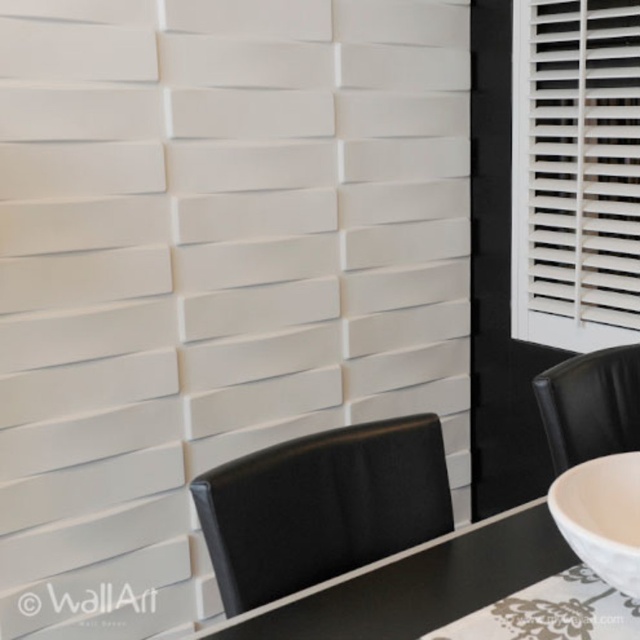
In the scene shown: Who is more forward, (275, 76) or (605, 378)?

Positioned in front is point (605, 378).

Is white matte shutter at right bigger than black leather chair at right?

Yes, white matte shutter at right is bigger than black leather chair at right.

Is point (198, 307) more distant than point (534, 394)?

No.

Where is `white matte shutter at right`? white matte shutter at right is located at coordinates (211, 273).

The height and width of the screenshot is (640, 640). Identify the location of white plastic blinds at upper right. (576, 172).

From the picture: Can you confirm if white plastic blinds at upper right is bigger than black leather chair at right?

Correct, white plastic blinds at upper right is larger in size than black leather chair at right.

Identify the location of white plastic blinds at upper right. Image resolution: width=640 pixels, height=640 pixels. (576, 172).

This screenshot has width=640, height=640. In order to click on white plastic blinds at upper right in this screenshot , I will do `click(576, 172)`.

Is white matte shutter at right closer to camera compared to black leather chair at center?

No, it is behind black leather chair at center.

From the picture: Is white matte shutter at right wider than black leather chair at center?

Yes, white matte shutter at right is wider than black leather chair at center.

What do you see at coordinates (211, 273) in the screenshot?
I see `white matte shutter at right` at bounding box center [211, 273].

In order to click on white matte shutter at right in this screenshot , I will do `click(211, 273)`.